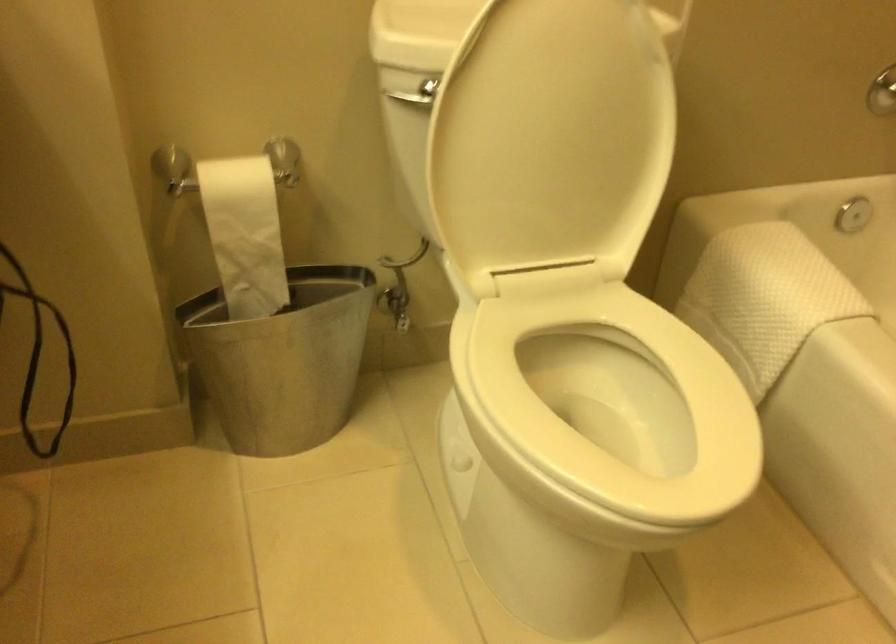
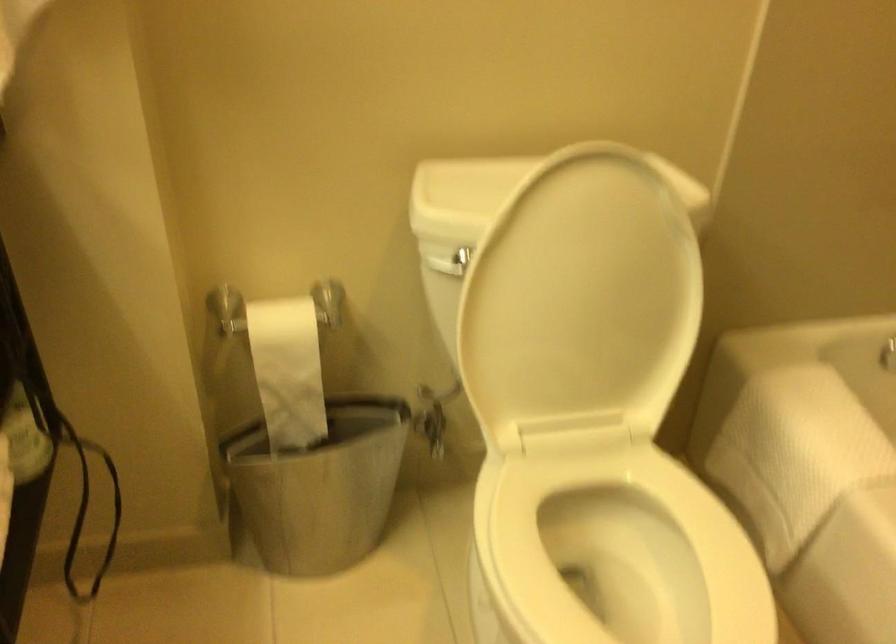
Find the pixel in the second image that matches (x=282, y=354) in the first image.

(319, 487)